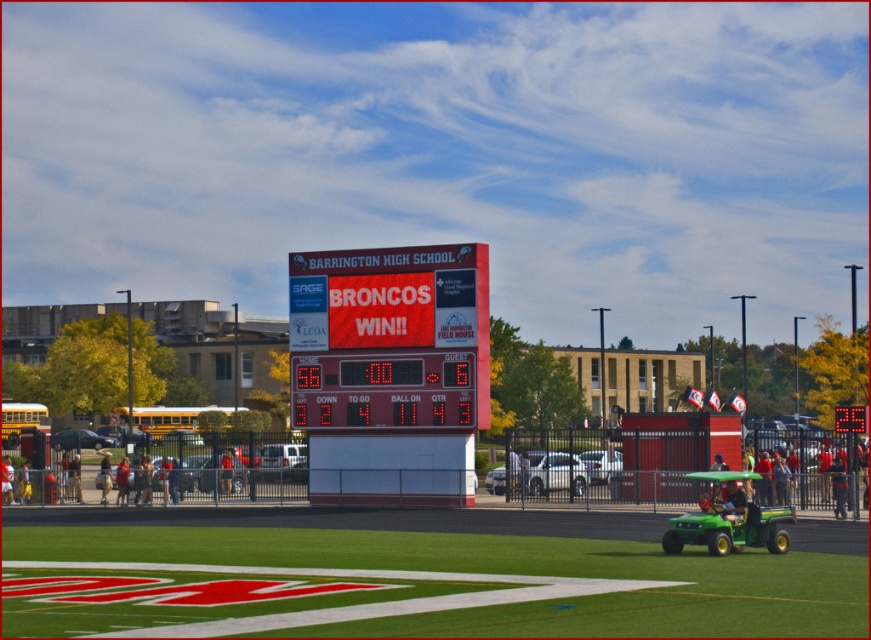
The image size is (871, 640). What are the coordinates of `green artificial turf at center` in the screenshot? It's located at (512, 573).

Which of these two, green artificial turf at center or denim jacket at lower left, stands shorter?

denim jacket at lower left

Describe the element at coordinates (512, 573) in the screenshot. I see `green artificial turf at center` at that location.

This screenshot has height=640, width=871. Identify the location of green artificial turf at center. (512, 573).

Does white digital scoreboard at center have a larger size compared to denim jacket at lower left?

Incorrect, white digital scoreboard at center is not larger than denim jacket at lower left.

At what (x,y) coordinates should I click in order to perform the action: click on white digital scoreboard at center. Please return your answer as a coordinate pair (x, y). Looking at the image, I should click on (392, 332).

This screenshot has height=640, width=871. What are the coordinates of `white digital scoreboard at center` in the screenshot? It's located at (392, 332).

This screenshot has width=871, height=640. Identify the location of digital display scoreboard at center. (383, 388).

Where is `digital display scoreboard at center`? digital display scoreboard at center is located at coordinates (383, 388).